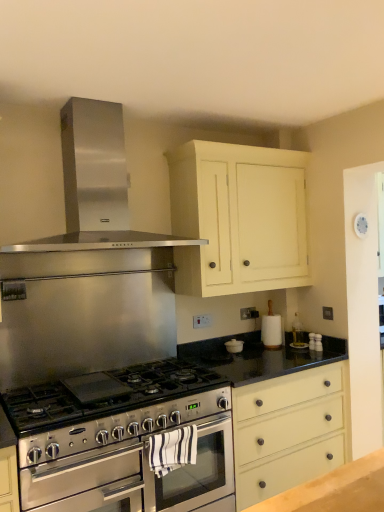
I want to click on free spot above stainless steel gas stove at center (from a real-world perspective), so click(88, 388).